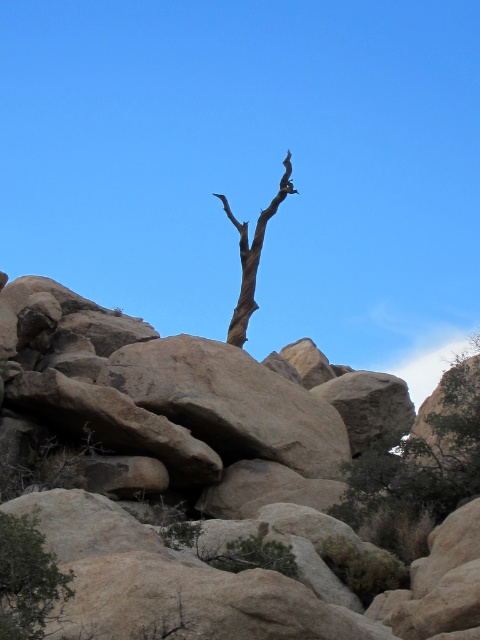
Can you confirm if brown rough rock at upper center is wider than green leafy tree at right?

Yes, brown rough rock at upper center is wider than green leafy tree at right.

Where is `brown rough rock at upper center`? brown rough rock at upper center is located at coordinates (205, 484).

Is point (307, 550) in front of point (422, 454)?

Yes.

Image resolution: width=480 pixels, height=640 pixels. In order to click on brown rough rock at upper center in this screenshot , I will do `click(205, 484)`.

Does brown rough rock at upper center appear on the left side of brown bark tree at center?

Indeed, brown rough rock at upper center is positioned on the left side of brown bark tree at center.

Who is shorter, brown rough rock at upper center or brown bark tree at center?

Standing shorter between the two is brown rough rock at upper center.

I want to click on brown rough rock at upper center, so click(x=205, y=484).

Does point (26, 621) lie behind point (289, 156)?

That is False.

Is point (54, 561) positioned behind point (282, 193)?

No, (54, 561) is closer to viewer.

Where is `green leafy shrub at lower left`? The height and width of the screenshot is (640, 480). green leafy shrub at lower left is located at coordinates (27, 579).